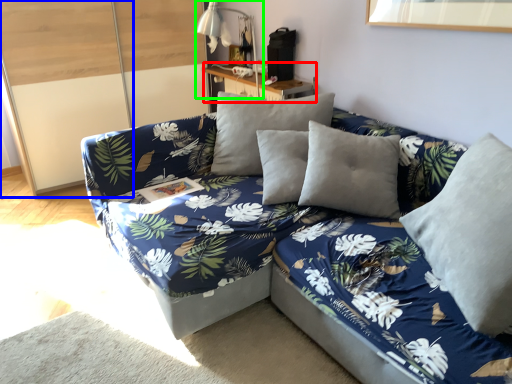
Question: Which object is the farthest from table (highlighted by a red box)? Choose among these: glass door (highlighted by a blue box) or table lamp (highlighted by a green box).

Choices:
 (A) glass door
 (B) table lamp

Answer: (A)